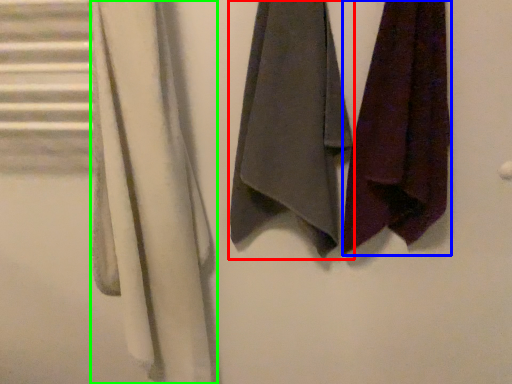
Question: Which object is positioned farthest from towel (highlighted by a red box)? Select from towel (highlighted by a blue box) and cloth (highlighted by a green box).

Choices:
 (A) towel
 (B) cloth

Answer: (B)